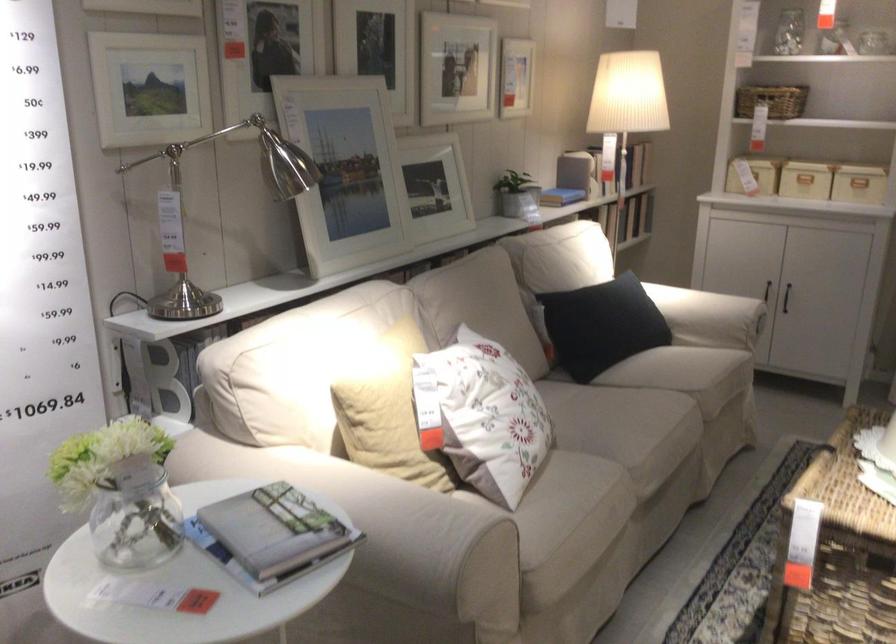
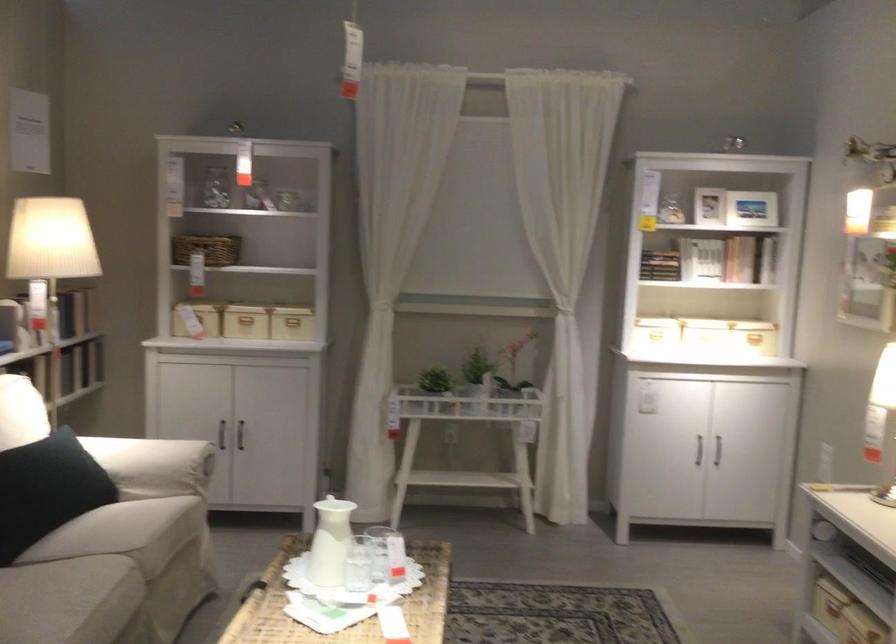
Question: I am providing you with two images of the same scene from different viewpoints. After the viewpoint changes to image2, which objects are now occluded?

Choices:
 (A) orange printer lid
 (B) beige storage box
 (C) white ceramic pitcher
 (D) dark cabinet handle

Answer: (B)